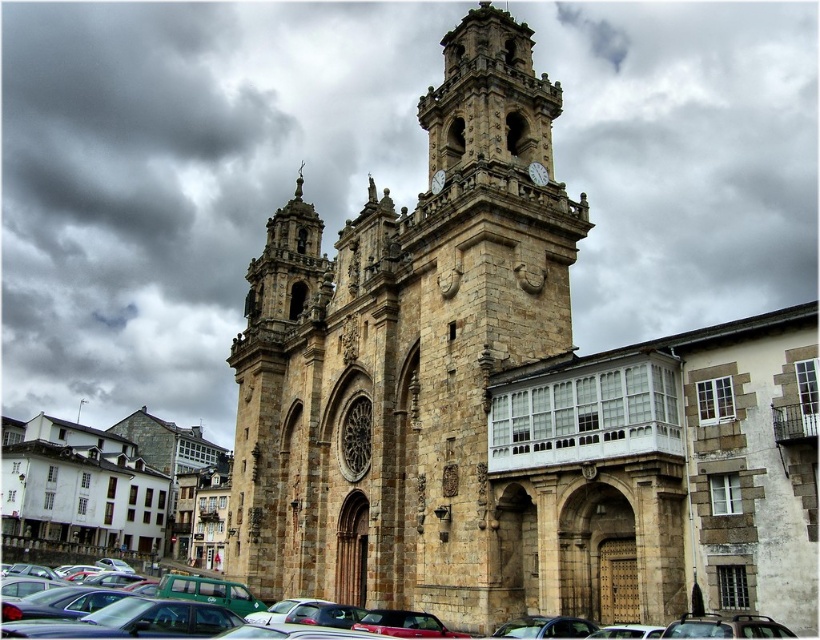
Question: Does stone church at center have a smaller size compared to metallic silver car at lower center?

Choices:
 (A) no
 (B) yes

Answer: (A)

Question: Is stone church at center smaller than metallic silver car at lower center?

Choices:
 (A) yes
 (B) no

Answer: (B)

Question: Which point is farther to the camera?

Choices:
 (A) (126, 636)
 (B) (598, 531)

Answer: (B)

Question: Among these objects, which one is farthest from the camera?

Choices:
 (A) metallic silver car at lower center
 (B) stone church at center

Answer: (B)

Question: Can you confirm if stone church at center is positioned to the left of metallic silver car at lower center?

Choices:
 (A) no
 (B) yes

Answer: (A)